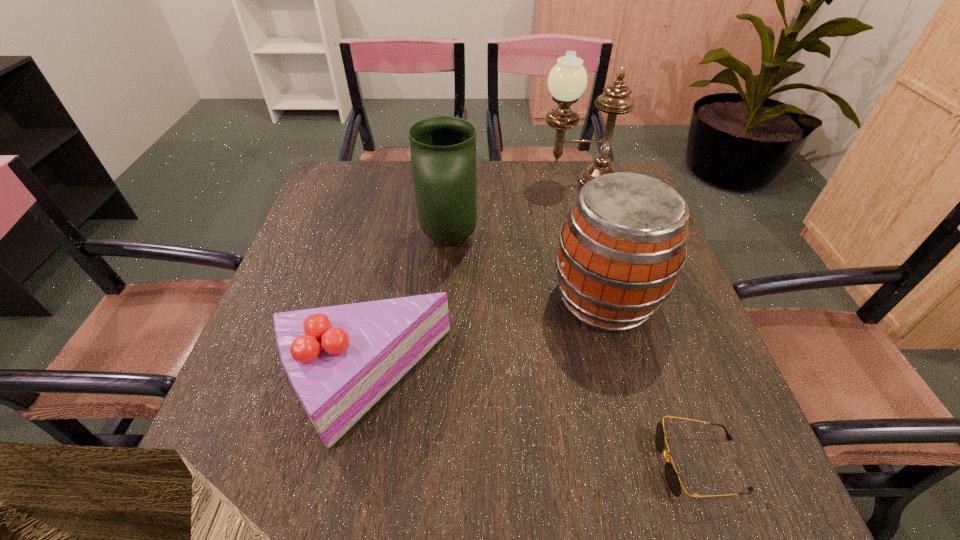
At what (x,y) coordinates should I click in order to perform the action: click on free spot between the second shortest object and the farthest object. Please return your answer as a coordinate pair (x, y). Looking at the image, I should click on (470, 282).

Locate an element on the screen. The height and width of the screenshot is (540, 960). vacant space that is in between the vase and the cider is located at coordinates (527, 269).

You are a GUI agent. You are given a task and a screenshot of the screen. Output one action in this format:
    pyautogui.click(x=<x>, y=<y>)
    Task: Click on the empty space between the cider and the vase
    The height and width of the screenshot is (540, 960).
    Given the screenshot: What is the action you would take?
    pyautogui.click(x=527, y=269)

Choose which object is the nearest neighbor to the cider. Please provide its 2D coordinates. Your answer should be formatted as a tuple, i.e. [(x, y)], where the tuple contains the x and y coordinates of a point satisfying the conditions above.

[(443, 149)]

Identify the location of object that is the second closest to the cake. This screenshot has height=540, width=960. (623, 244).